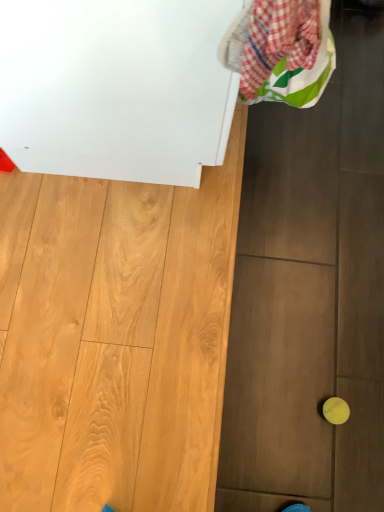
Identify the location of free space to the right of white glossy cabinet at upper left. Image resolution: width=384 pixels, height=512 pixels. (315, 166).